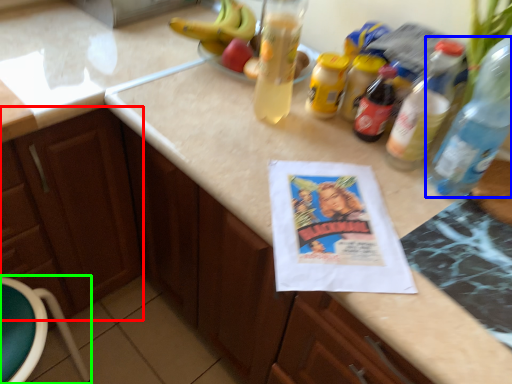
Question: Which is nearer to the cabinetry (highlighted by a red box)? bottle (highlighted by a blue box) or bar stool (highlighted by a green box).

Choices:
 (A) bottle
 (B) bar stool

Answer: (B)